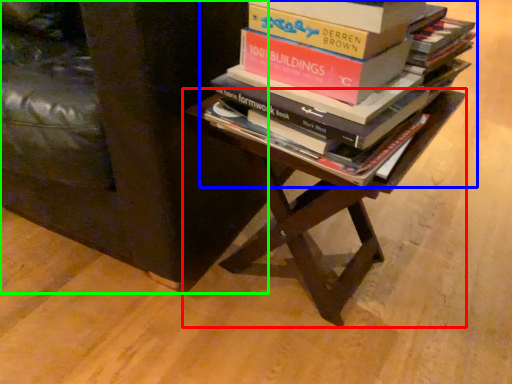
Question: Based on their relative distances, which object is farther from table (highlighted by a red box)? Choose from book (highlighted by a blue box) and furniture (highlighted by a green box).

Choices:
 (A) book
 (B) furniture

Answer: (B)